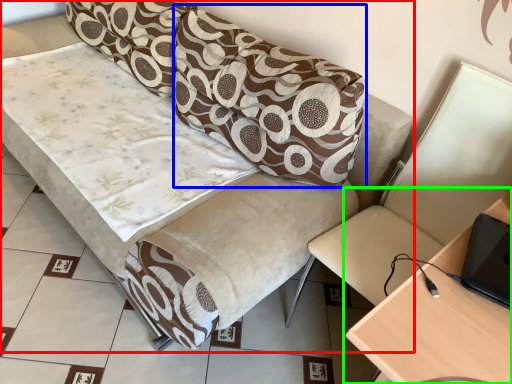
Question: Estimate the real-world distances between objects in this image. Which object is closer to studio couch (highlighted by a red box), pillow (highlighted by a blue box) or table (highlighted by a green box)?

Choices:
 (A) pillow
 (B) table

Answer: (A)